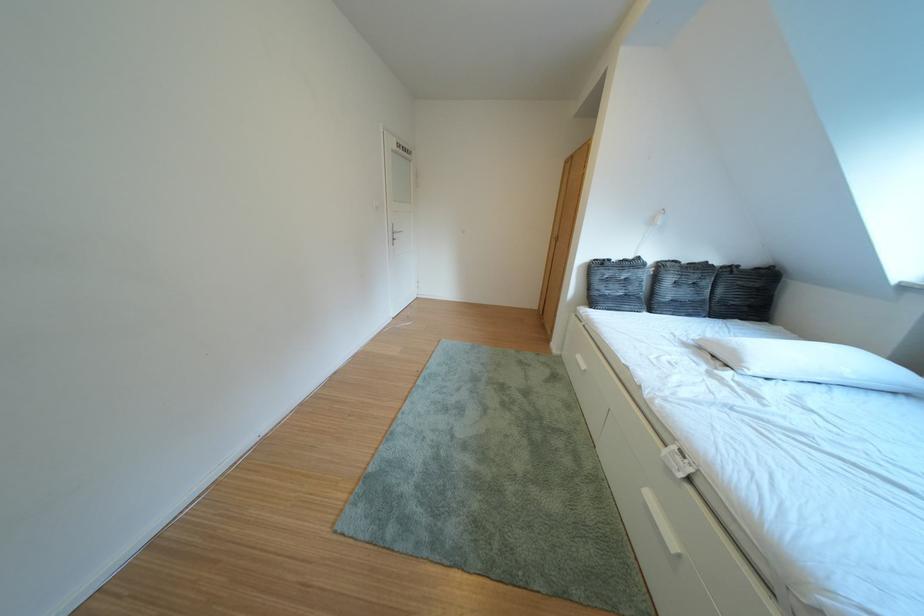
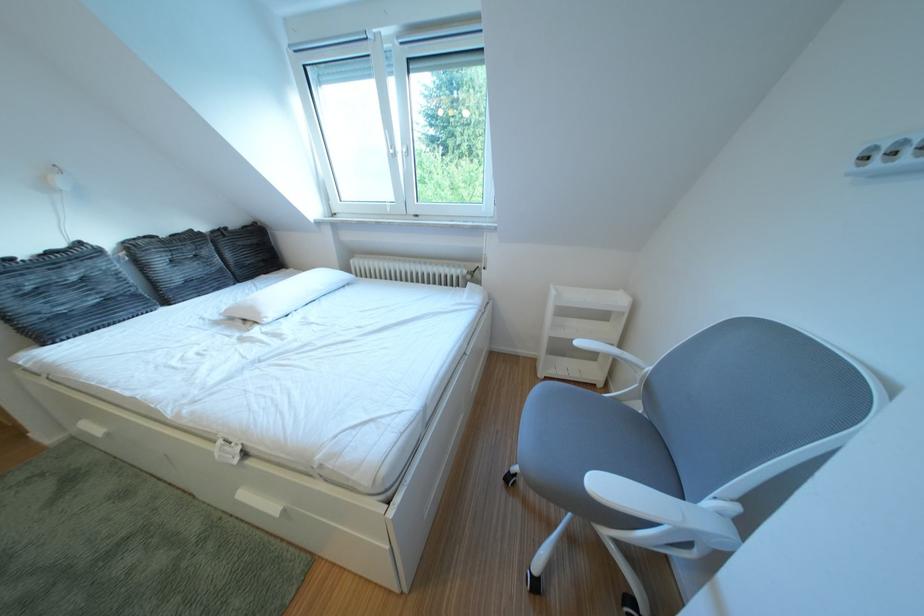
Locate, in the second image, the point that corresponds to point (652, 262) in the first image.

(93, 249)